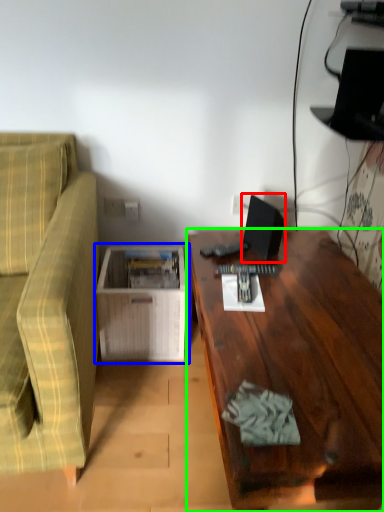
Question: Which object is the closest to the computer monitor (highlighted by a red box)? Choose among these: table (highlighted by a blue box) or desk (highlighted by a green box).

Choices:
 (A) table
 (B) desk

Answer: (B)